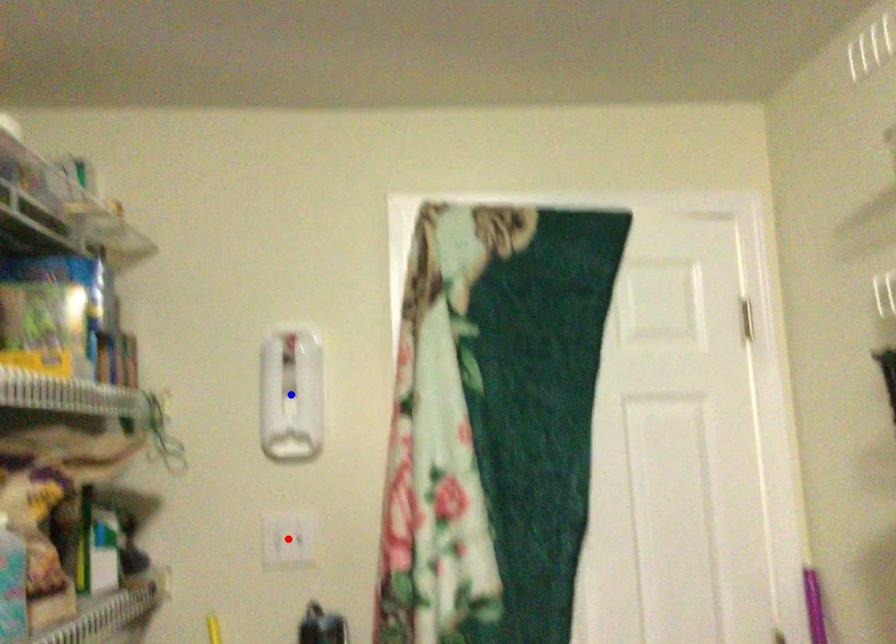
Question: In the image, two points are highlighted. Which point is nearer to the camera? Reply with the corresponding letter.

Choices:
 (A) blue point
 (B) red point

Answer: (B)